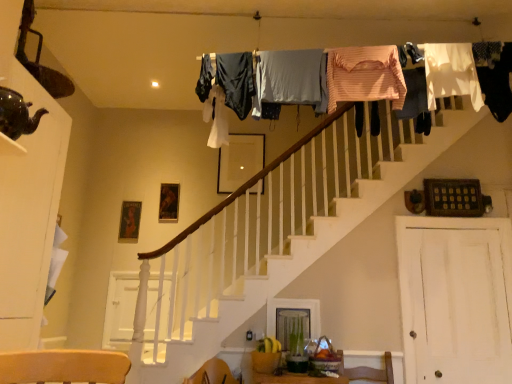
Question: From a real-world perspective, is dark blue fabric at upper center, which is the 7th clothing in right-to-left order, below white painted wood at lower left, the 2th barn door when ordered from front to back?

Choices:
 (A) yes
 (B) no

Answer: (B)

Question: From a real-world perspective, is dark blue fabric at upper center, positioned as the first clothing in left-to-right order, located higher than white painted wood at lower left, the 2th barn door when ordered from front to back?

Choices:
 (A) yes
 (B) no

Answer: (A)

Question: Is the depth of dark blue fabric at upper center, positioned as the first clothing in left-to-right order, less than that of white painted wood at lower left, arranged as the second barn door when viewed from the right?

Choices:
 (A) no
 (B) yes

Answer: (B)

Question: Is dark blue fabric at upper center, positioned as the first clothing in left-to-right order, to the left of white painted wood at lower left, the first barn door when ordered from left to right, from the viewer's perspective?

Choices:
 (A) yes
 (B) no

Answer: (B)

Question: From the image's perspective, is dark blue fabric at upper center, which is the 7th clothing in right-to-left order, located beneath white painted wood at lower left, the 2th barn door when ordered from front to back?

Choices:
 (A) no
 (B) yes

Answer: (A)

Question: Considering the positions of white fabric at upper right, the 2th clothing positioned from the right, and light gray fabric at upper center, acting as the 3th clothing starting from the left, in the image, is white fabric at upper right, the 2th clothing positioned from the right, taller or shorter than light gray fabric at upper center, acting as the 3th clothing starting from the left,?

Choices:
 (A) tall
 (B) short

Answer: (A)

Question: Is white fabric at upper right, the sixth clothing in the left-to-right sequence, wider or thinner than light gray fabric at upper center, which ranks as the fifth clothing in right-to-left order?

Choices:
 (A) thin
 (B) wide

Answer: (A)

Question: Considering their positions, is white fabric at upper right, the 2th clothing positioned from the right, located in front of or behind light gray fabric at upper center, which ranks as the fifth clothing in right-to-left order?

Choices:
 (A) behind
 (B) front

Answer: (A)

Question: From a real-world perspective, relative to light gray fabric at upper center, which ranks as the fifth clothing in right-to-left order, is white fabric at upper right, the sixth clothing in the left-to-right sequence, vertically above or below?

Choices:
 (A) above
 (B) below

Answer: (A)

Question: Would you say pink fabric at upper right, placed as the 3th clothing when sorted from right to left, is inside or outside shiny dark green teapot at upper left?

Choices:
 (A) inside
 (B) outside

Answer: (B)

Question: From the image's perspective, is pink fabric at upper right, which is the fifth clothing from left to right, located above or below shiny dark green teapot at upper left?

Choices:
 (A) above
 (B) below

Answer: (A)

Question: From a real-world perspective, is pink fabric at upper right, placed as the 3th clothing when sorted from right to left, above or below shiny dark green teapot at upper left?

Choices:
 (A) below
 (B) above

Answer: (B)

Question: Considering the positions of point (407, 107) and point (19, 105), is point (407, 107) closer or farther from the camera than point (19, 105)?

Choices:
 (A) closer
 (B) farther

Answer: (B)

Question: Considering their positions, is white fabric at upper right, the 2th clothing positioned from the right, located in front of or behind pink fabric at upper right, placed as the 3th clothing when sorted from right to left?

Choices:
 (A) front
 (B) behind

Answer: (A)

Question: In terms of size, does white fabric at upper right, the sixth clothing in the left-to-right sequence, appear bigger or smaller than pink fabric at upper right, which is the fifth clothing from left to right?

Choices:
 (A) big
 (B) small

Answer: (A)